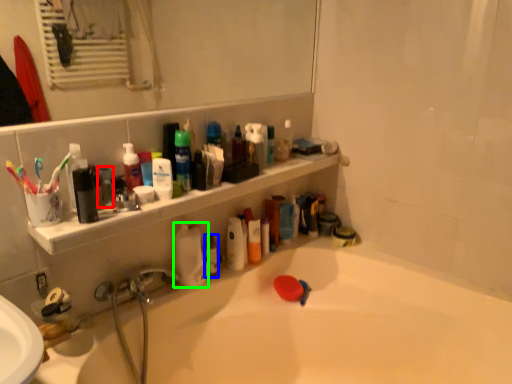
Question: Considering the real-world distances, which object is farthest from mouthwash (highlighted by a red box)? mouthwash (highlighted by a blue box) or cleaning product (highlighted by a green box)?

Choices:
 (A) mouthwash
 (B) cleaning product

Answer: (A)